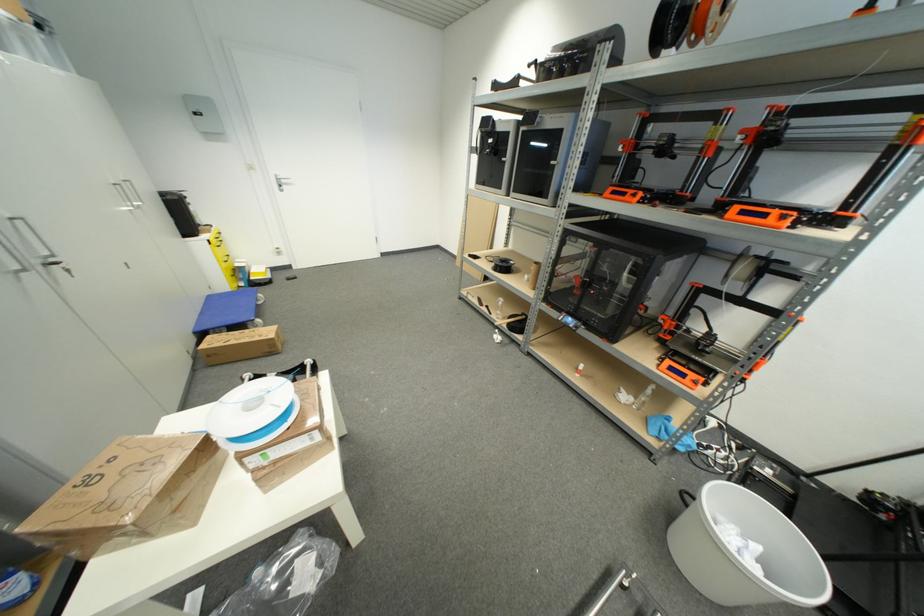
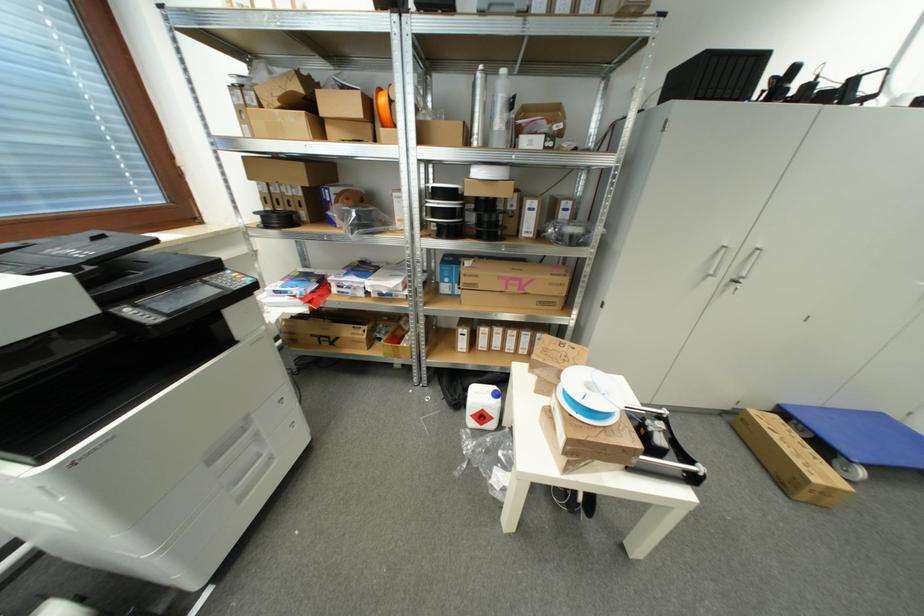
Find the pixel in the second image that matches (213,339) in the first image.

(781, 419)